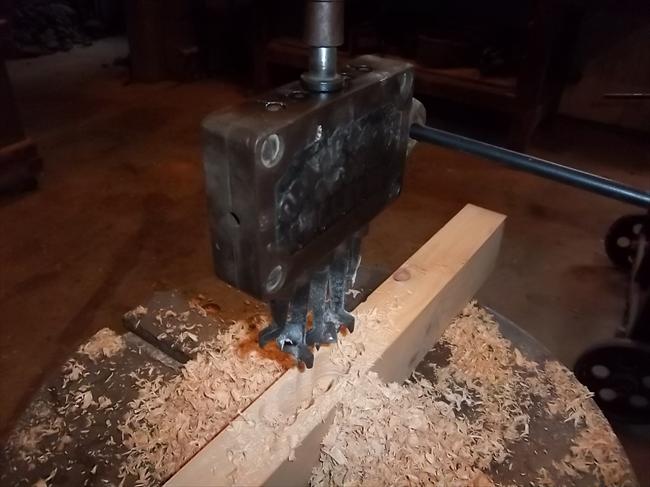
Locate an element on the screen. The height and width of the screenshot is (487, 650). screws is located at coordinates (262, 147), (272, 283), (400, 93), (359, 65), (270, 110), (227, 219).